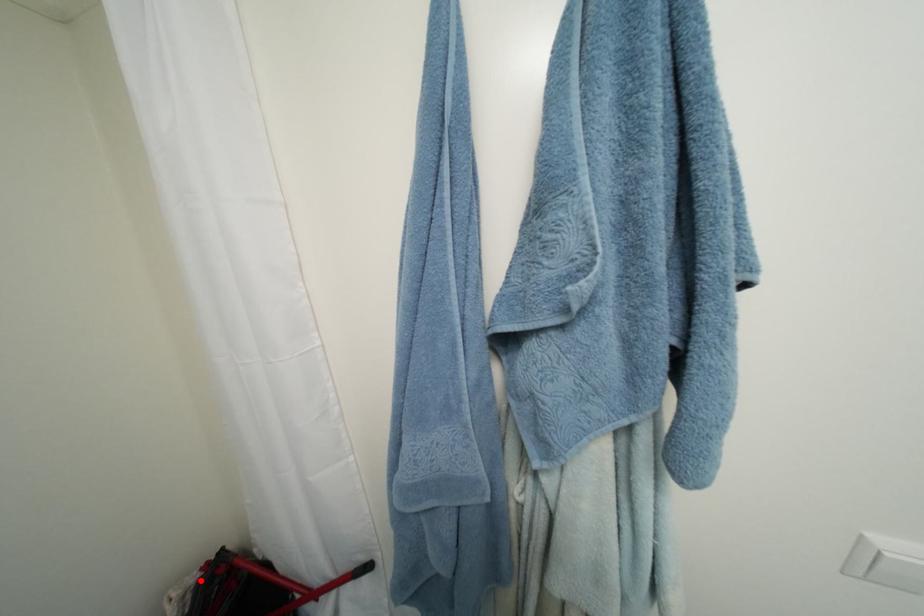
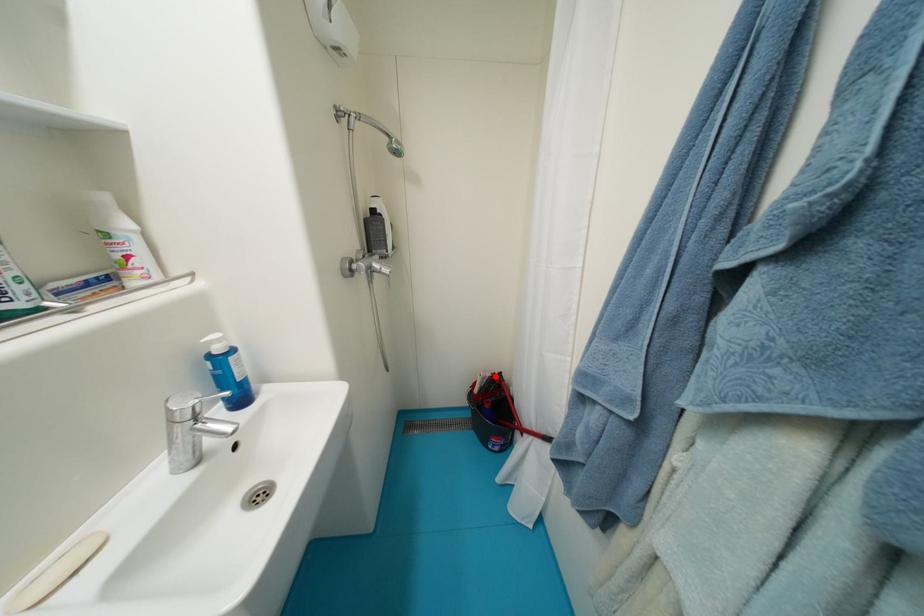
I am providing you with two images of the same scene from different viewpoints. A red point is marked on the first image and another point is marked on the second image. Does the point marked in image1 correspond to the same location as the one in image2?

Yes